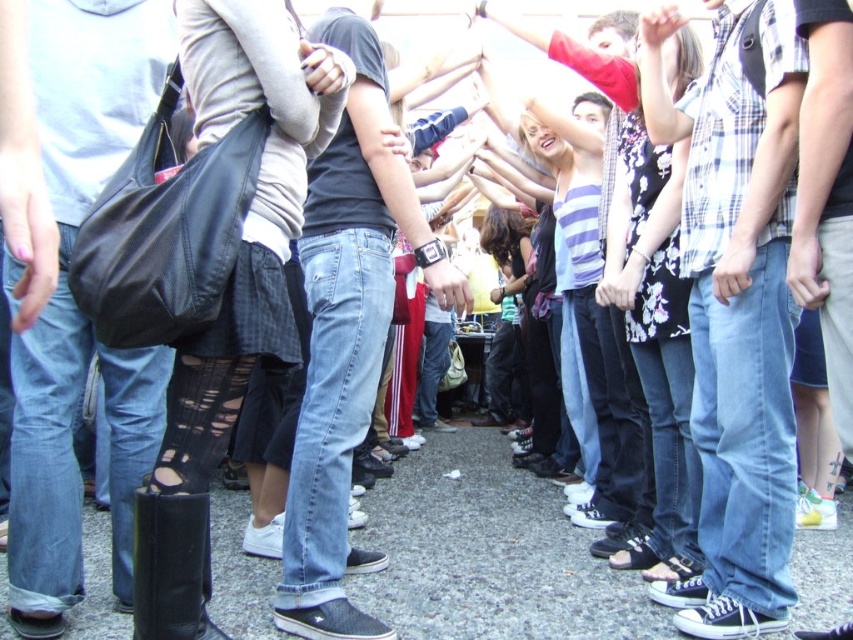
Locate an element on the screen. This screenshot has height=640, width=853. plaid cotton shirt at center is located at coordinates (735, 310).

In order to click on plaid cotton shirt at center in this screenshot , I will do `click(735, 310)`.

Find the location of a particular element. Image resolution: width=853 pixels, height=640 pixels. plaid cotton shirt at center is located at coordinates (735, 310).

Does matte black bag at left have a greater width compared to jeans at center?

Incorrect, matte black bag at left's width does not surpass jeans at center's.

Is point (73, 228) more distant than point (364, 12)?

No, (73, 228) is closer to viewer.

You are a GUI agent. You are given a task and a screenshot of the screen. Output one action in this format:
    pyautogui.click(x=<x>, y=<y>)
    Task: Click on the matte black bag at left
    
    Given the screenshot: What is the action you would take?
    pyautogui.click(x=74, y=305)

Which is below, plaid cotton shirt at center or matte black bag at left?

plaid cotton shirt at center is below.

Find the location of a particular element. This screenshot has width=853, height=640. plaid cotton shirt at center is located at coordinates (735, 310).

Identify the location of plaid cotton shirt at center. This screenshot has width=853, height=640. (735, 310).